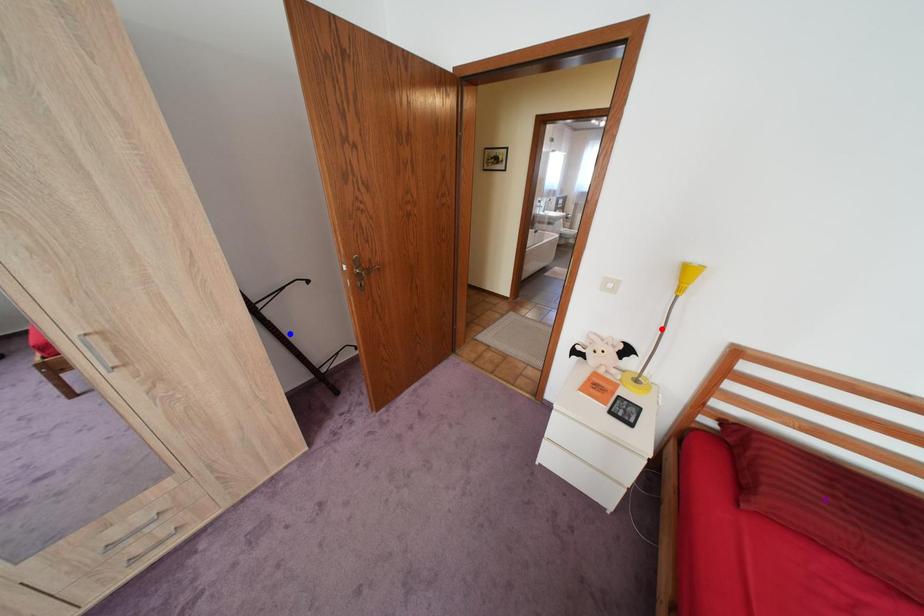
Order these from nearest to farthest:
red point | purple point | blue point

blue point
red point
purple point